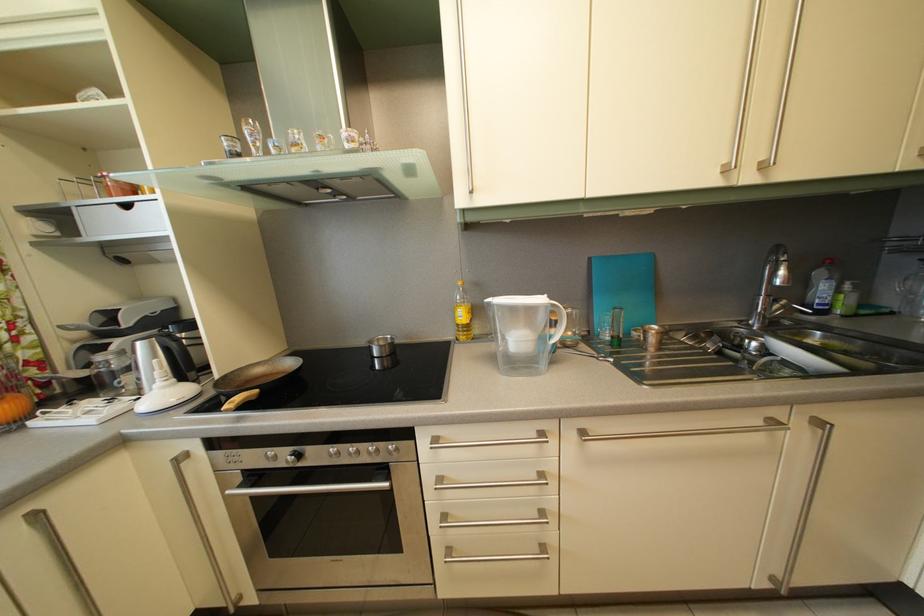
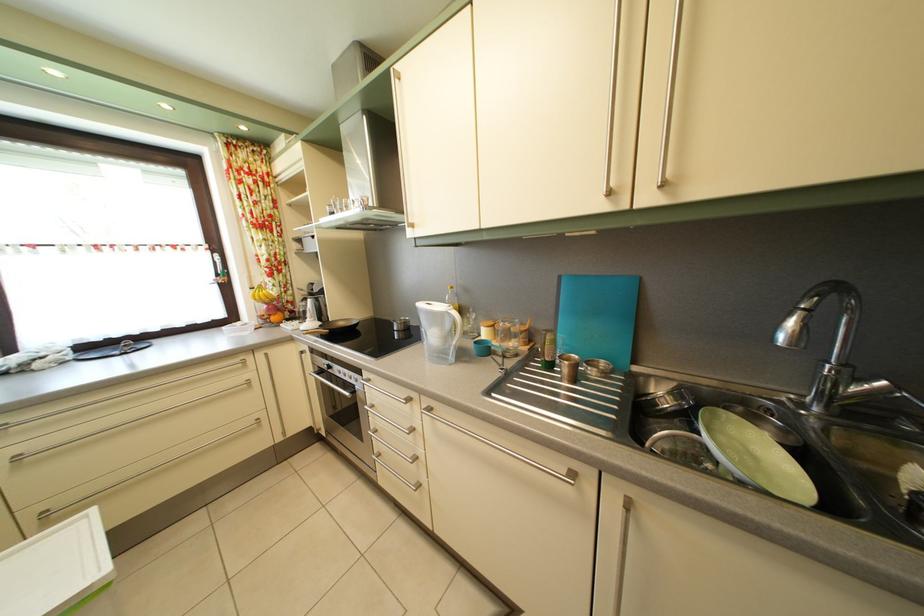
Find the pixel in the second image that matches pixel 447 487 in the first image.

(381, 414)